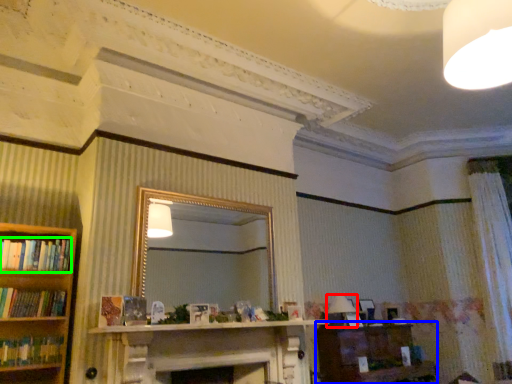
Question: Which object is the closest to the lamp (highlighted by a red box)? Choose among these: vanity (highlighted by a blue box) or book (highlighted by a green box).

Choices:
 (A) vanity
 (B) book

Answer: (A)